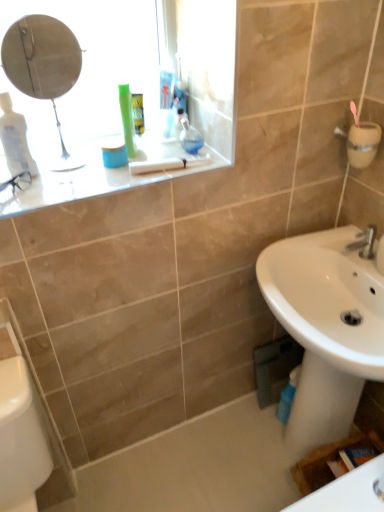
Question: Can you confirm if white glossy bath at lower center is taller than silver metallic faucet at lower right?

Choices:
 (A) yes
 (B) no

Answer: (B)

Question: Are white glossy bath at lower center and silver metallic faucet at lower right located far from each other?

Choices:
 (A) yes
 (B) no

Answer: (B)

Question: Considering the relative positions of white glossy bath at lower center and silver metallic faucet at lower right in the image provided, is white glossy bath at lower center behind silver metallic faucet at lower right?

Choices:
 (A) yes
 (B) no

Answer: (A)

Question: Is white glossy bath at lower center directly adjacent to silver metallic faucet at lower right?

Choices:
 (A) yes
 (B) no

Answer: (B)

Question: Does white glossy bath at lower center have a lesser width compared to silver metallic faucet at lower right?

Choices:
 (A) yes
 (B) no

Answer: (B)

Question: Is white glossy bath at lower center to the left or to the right of white glossy counter top at upper left in the image?

Choices:
 (A) left
 (B) right

Answer: (B)

Question: Is white glossy bath at lower center inside the boundaries of white glossy counter top at upper left, or outside?

Choices:
 (A) outside
 (B) inside

Answer: (A)

Question: Relative to white glossy counter top at upper left, is white glossy bath at lower center in front or behind?

Choices:
 (A) front
 (B) behind

Answer: (B)

Question: Considering the positions of point (221, 421) and point (160, 150), is point (221, 421) closer or farther from the camera than point (160, 150)?

Choices:
 (A) farther
 (B) closer

Answer: (A)

Question: In the image, is white glossy porcelain at lower left on the left side or the right side of white glossy sink at lower right?

Choices:
 (A) left
 (B) right

Answer: (A)

Question: From a real-world perspective, is white glossy porcelain at lower left positioned above or below white glossy sink at lower right?

Choices:
 (A) above
 (B) below

Answer: (B)

Question: Considering the positions of white glossy porcelain at lower left and white glossy sink at lower right in the image, is white glossy porcelain at lower left wider or thinner than white glossy sink at lower right?

Choices:
 (A) thin
 (B) wide

Answer: (A)

Question: Considering the positions of point (11, 494) and point (359, 318), is point (11, 494) closer or farther from the camera than point (359, 318)?

Choices:
 (A) farther
 (B) closer

Answer: (B)

Question: Looking at their shapes, would you say white glossy counter top at upper left is wider or thinner than white glossy sink at lower right?

Choices:
 (A) thin
 (B) wide

Answer: (A)

Question: In terms of height, does white glossy counter top at upper left look taller or shorter compared to white glossy sink at lower right?

Choices:
 (A) tall
 (B) short

Answer: (B)